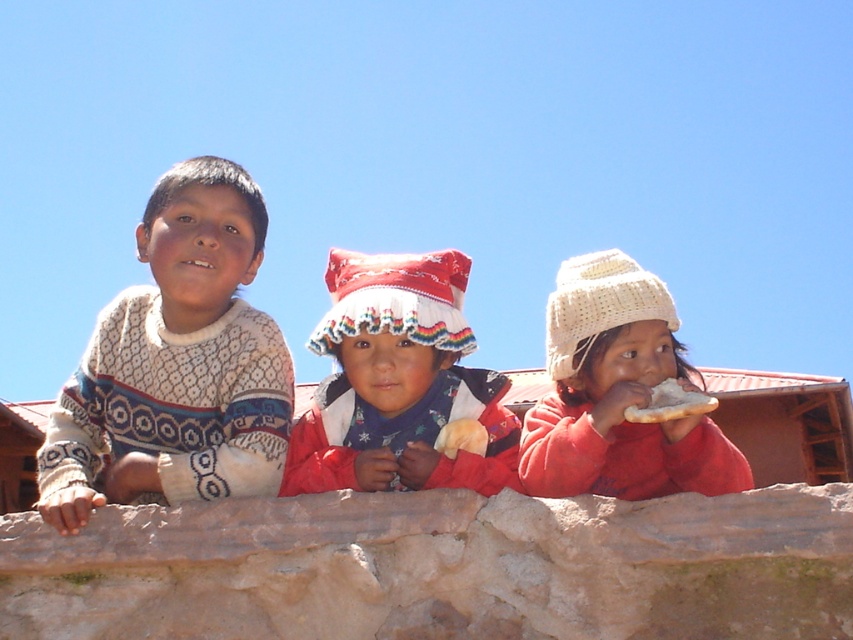
Question: Can you confirm if white knitted hat at upper center is positioned to the left of white bread at center?

Choices:
 (A) yes
 (B) no

Answer: (B)

Question: Is white knitted sweater at left closer to the viewer compared to white fluffy bread at center?

Choices:
 (A) no
 (B) yes

Answer: (B)

Question: Can you confirm if brown rough stone at center is positioned below white bread at center?

Choices:
 (A) yes
 (B) no

Answer: (A)

Question: Which is nearer to the red and white knitted hat at center?

Choices:
 (A) white fluffy bread at center
 (B) white knitted sweater at left
 (C) white bread at center

Answer: (C)

Question: Which point is closer to the camera?

Choices:
 (A) (160, 374)
 (B) (676, 385)
 (C) (734, 573)
 (D) (451, 433)

Answer: (C)

Question: Which of these objects is positioned farthest from the red and white knitted hat at center?

Choices:
 (A) brown rough stone at center
 (B) white fluffy bread at center
 (C) white bread at center

Answer: (B)